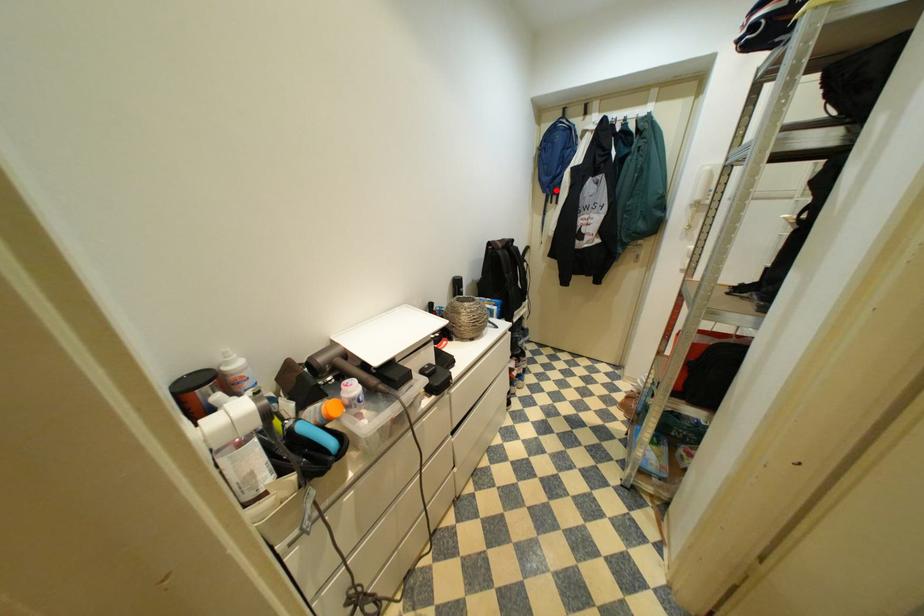
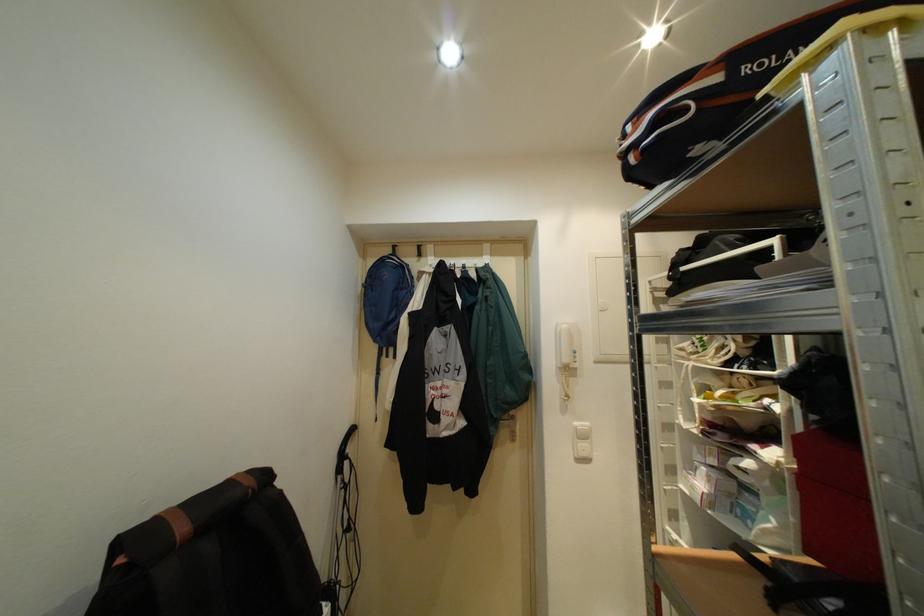
Question: I am providing you with two images of the same scene from different viewpoints. In image1, a red point is highlighted. Considering the same 3D point in image2, which of the following is correct?

Choices:
 (A) It is closer
 (B) It is farther

Answer: (B)